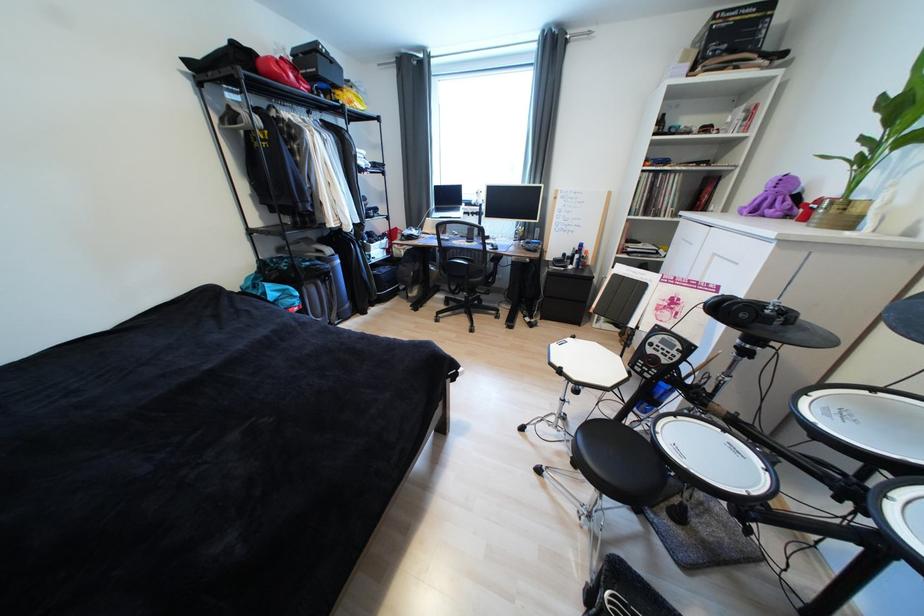
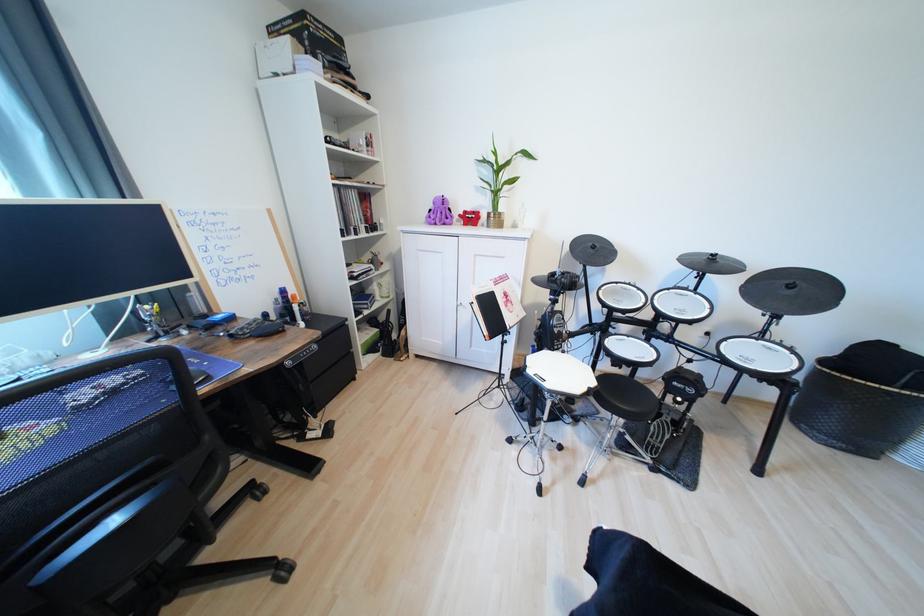
In the second image, find the point that corresponds to the point at 828,201 in the first image.

(472, 214)